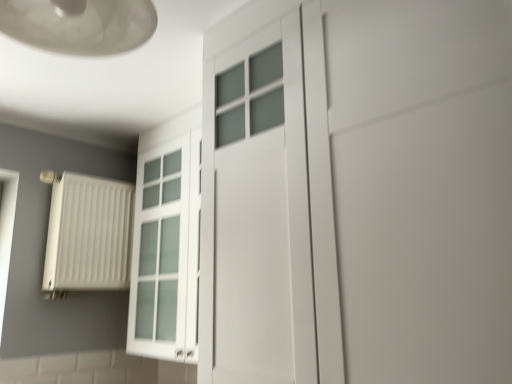
Describe the element at coordinates (80, 24) in the screenshot. I see `matte glass lampshade at upper left` at that location.

Find the location of `white matte door at center`. white matte door at center is located at coordinates (414, 187).

Identify the location of white matte radiator at left. (87, 233).

Find the location of a particular element. The width and height of the screenshot is (512, 384). matte glass lampshade at upper left is located at coordinates (80, 24).

Are matte glass lampshade at upper left and white matte door at center located far from each other?

They are positioned close to each other.

Would you say matte glass lampshade at upper left is to the left or to the right of white matte door at center in the picture?

Based on their positions, matte glass lampshade at upper left is located to the left of white matte door at center.

Is point (119, 13) closer to camera compared to point (371, 172)?

Yes, point (119, 13) is in front of point (371, 172).

Does matte glass lampshade at upper left turn towards white matte door at center?

No, matte glass lampshade at upper left does not turn towards white matte door at center.

Could you tell me if matte glass lampshade at upper left is turned towards white matte radiator at left?

No, matte glass lampshade at upper left does not turn towards white matte radiator at left.

From the picture: Which object is further away from the camera taking this photo, matte glass lampshade at upper left or white matte radiator at left?

white matte radiator at left.

There is a white matte radiator at left. Identify the location of lamp above it (from a real-world perspective). Image resolution: width=512 pixels, height=384 pixels. (80, 24).

Considering the relative positions of white matte door at center and matte glass lampshade at upper left in the image provided, is white matte door at center to the right of matte glass lampshade at upper left from the viewer's perspective?

Indeed, white matte door at center is positioned on the right side of matte glass lampshade at upper left.

Which object is wider, white matte door at center or matte glass lampshade at upper left?

With larger width is white matte door at center.

Is white matte door at center in contact with matte glass lampshade at upper left?

No.

The height and width of the screenshot is (384, 512). In order to click on door behind the matte glass lampshade at upper left in this screenshot , I will do `click(414, 187)`.

Is white matte radiator at left not within matte glass lampshade at upper left?

white matte radiator at left lies outside matte glass lampshade at upper left's area.

Who is taller, white matte radiator at left or matte glass lampshade at upper left?

white matte radiator at left is taller.

Measure the distance between white matte radiator at left and matte glass lampshade at upper left.

white matte radiator at left and matte glass lampshade at upper left are 4.20 feet apart from each other.

Could you tell me if white matte radiator at left is turned towards matte glass lampshade at upper left?

Yes.

Is white matte door at center looking in the opposite direction of white matte radiator at left?

No, white matte radiator at left is not at the back of white matte door at center.

From the image's perspective, which is above, white matte door at center or white matte radiator at left?

From the image's view, white matte door at center is above.

Where is `radiator below the white matte door at center (from the image's perspective)`? This screenshot has height=384, width=512. radiator below the white matte door at center (from the image's perspective) is located at coordinates tap(87, 233).

From a real-world perspective, which is physically above, white matte door at center or white matte radiator at left?

In real-world perspective, white matte door at center is above.

Considering the sizes of objects white matte radiator at left and white matte door at center in the image provided, who is wider, white matte radiator at left or white matte door at center?

white matte door at center.

You are a GUI agent. You are given a task and a screenshot of the screen. Output one action in this format:
    pyautogui.click(x=<x>, y=<y>)
    Task: Click on the door above the white matte radiator at left (from the image's perspective)
    The height and width of the screenshot is (384, 512).
    Given the screenshot: What is the action you would take?
    pyautogui.click(x=414, y=187)

Is white matte radiator at left completely or partially outside of white matte door at center?

Absolutely, white matte radiator at left is external to white matte door at center.

Which object is further away from the camera taking this photo, white matte radiator at left or white matte door at center?

white matte radiator at left is further away from the camera.

The width and height of the screenshot is (512, 384). Find the location of `lamp located above the white matte door at center (from a real-world perspective)`. lamp located above the white matte door at center (from a real-world perspective) is located at coordinates (80, 24).

Locate an element on the screen. Image resolution: width=512 pixels, height=384 pixels. lamp in front of the white matte radiator at left is located at coordinates (80, 24).

Which object lies nearer to the anchor point white matte radiator at left, white matte door at center or matte glass lampshade at upper left?

Based on the image, matte glass lampshade at upper left appears to be nearer to white matte radiator at left.

Estimate the real-world distances between objects in this image. Which object is further from matte glass lampshade at upper left, white matte door at center or white matte radiator at left?

white matte radiator at left is positioned further to the anchor matte glass lampshade at upper left.

In the scene shown: Which object lies further to the anchor point white matte door at center, matte glass lampshade at upper left or white matte radiator at left?

white matte radiator at left is positioned further to the anchor white matte door at center.

Looking at the image, which one is located further to white matte radiator at left, matte glass lampshade at upper left or white matte door at center?

white matte door at center is further to white matte radiator at left.

From the image, which object appears to be nearer to matte glass lampshade at upper left, white matte radiator at left or white matte door at center?

white matte door at center.

Which object lies further to the anchor point white matte door at center, white matte radiator at left or matte glass lampshade at upper left?

white matte radiator at left.

Identify the location of door between matte glass lampshade at upper left and white matte radiator at left from front to back. (414, 187).